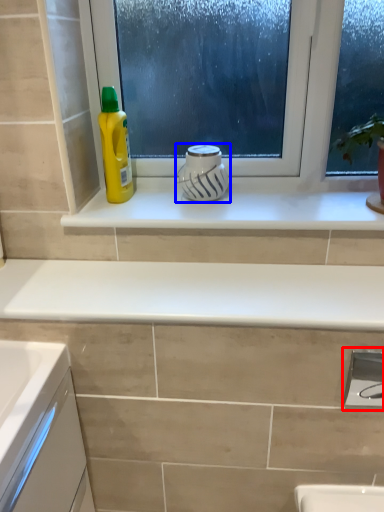
Question: Which object appears farthest to the camera in this image, faucet (highlighted by a red box) or appliance (highlighted by a blue box)?

Choices:
 (A) faucet
 (B) appliance

Answer: (B)